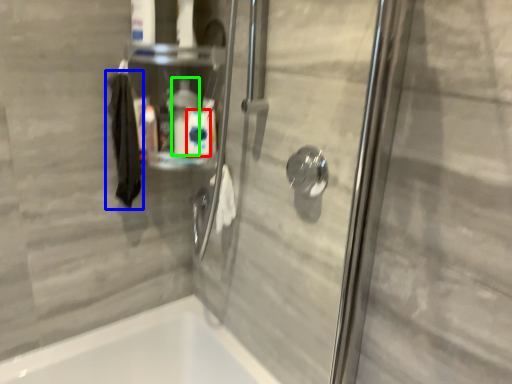
Question: Based on their relative distances, which object is nearer to cleaning product (highlighted by a red box)? Choose from hand towel (highlighted by a blue box) and cleaning product (highlighted by a green box).

Choices:
 (A) hand towel
 (B) cleaning product

Answer: (B)